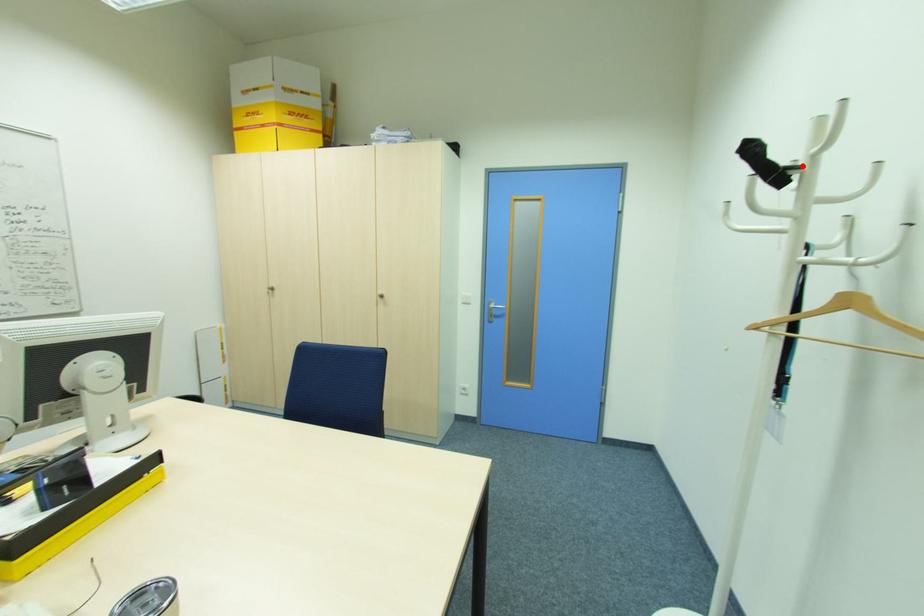
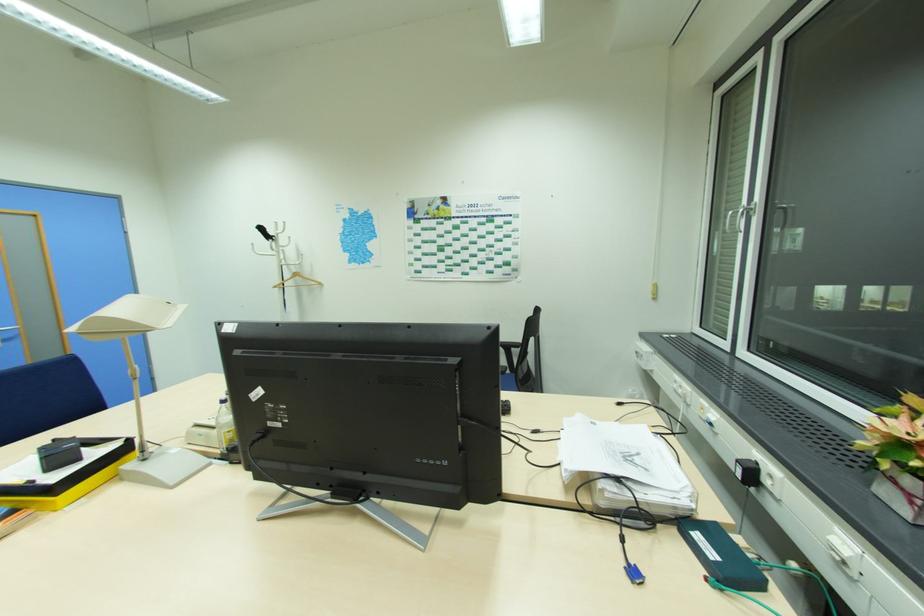
In the second image, find the point that corresponds to the highlighted location in the first image.

(276, 237)